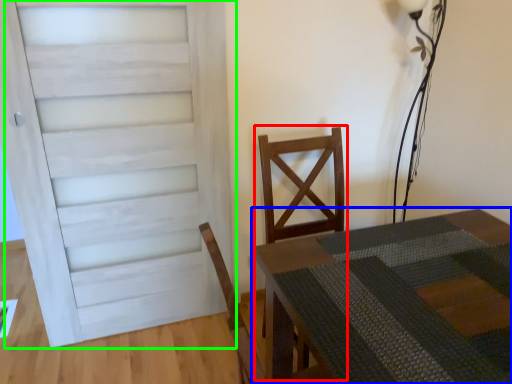
Question: Which object is the farthest from armchair (highlighted by a red box)? Choose among these: table (highlighted by a blue box) or door (highlighted by a green box).

Choices:
 (A) table
 (B) door

Answer: (B)